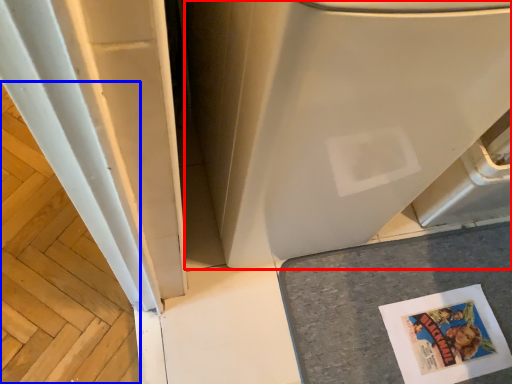
Question: Among these objects, which one is nearest to the camera, water heater (highlighted by a red box) or wood (highlighted by a blue box)?

Choices:
 (A) water heater
 (B) wood

Answer: (A)